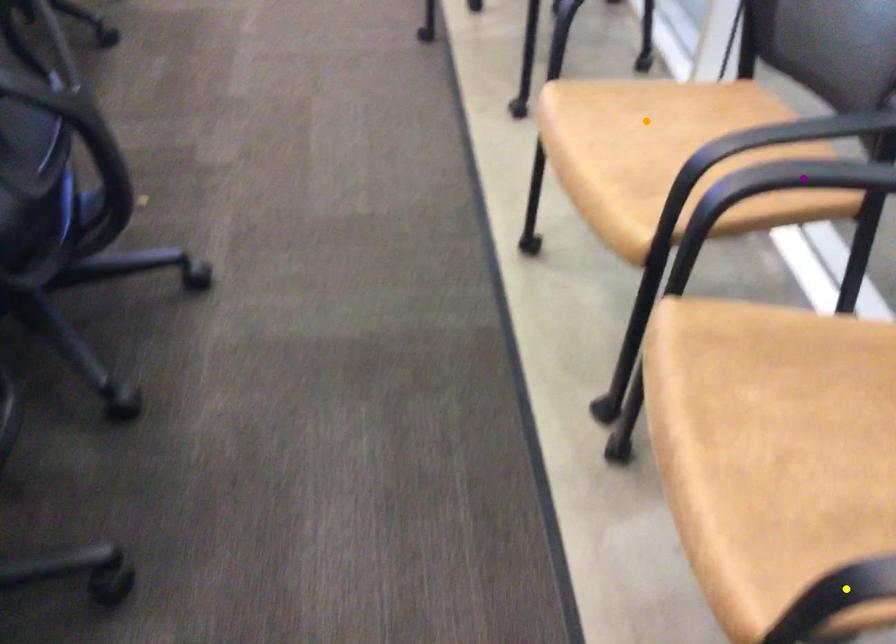
Order these from nearest to farthest:
A) purple point
B) yellow point
C) orange point

yellow point, purple point, orange point